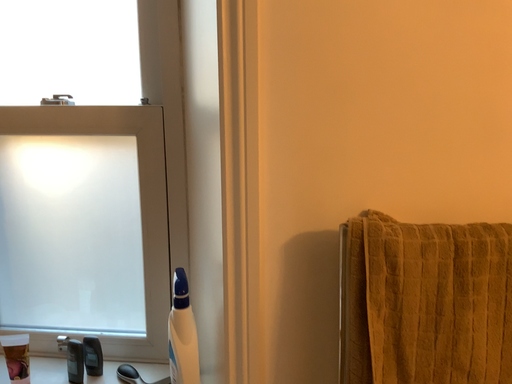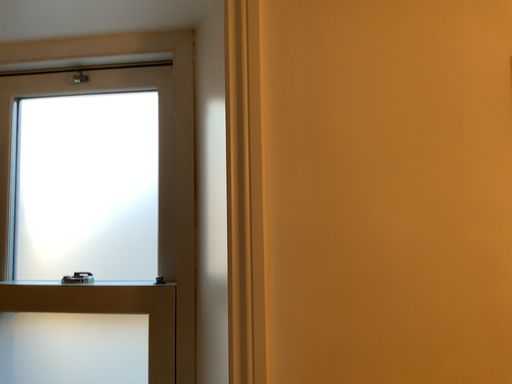
Question: How did the camera likely rotate when shooting the video?

Choices:
 (A) rotated downward
 (B) rotated upward

Answer: (B)